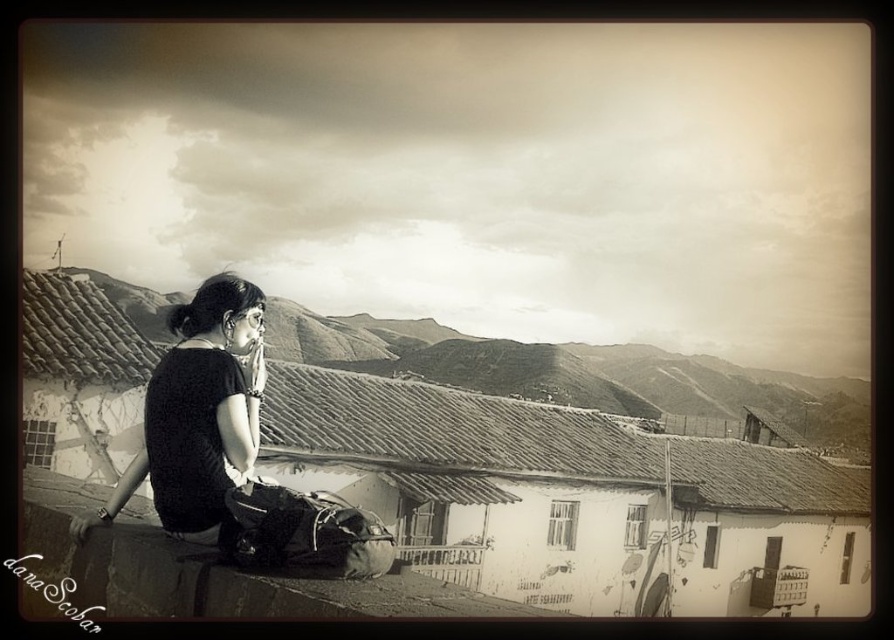
Which of these two, black matte shirt at center or matte black backpack at lower center, stands taller?

With more height is black matte shirt at center.

Is black matte shirt at center below matte black backpack at lower center?

Incorrect, black matte shirt at center is not positioned below matte black backpack at lower center.

Is point (237, 403) farther from viewer compared to point (367, 561)?

Yes, point (237, 403) is behind point (367, 561).

Locate an element on the screen. This screenshot has width=894, height=640. black matte shirt at center is located at coordinates (198, 412).

I want to click on smooth concrete ledge at lower left, so click(x=106, y=548).

At what (x,y) coordinates should I click in order to perform the action: click on smooth concrete ledge at lower left. Please return your answer as a coordinate pair (x, y). The width and height of the screenshot is (894, 640). Looking at the image, I should click on (106, 548).

Find the location of `smooth concrete ledge at lower left`. smooth concrete ledge at lower left is located at coordinates (106, 548).

Which is more to the left, smooth concrete ledge at lower left or matte black backpack at lower center?

smooth concrete ledge at lower left

Does point (89, 561) come closer to viewer compared to point (311, 573)?

That is False.

Locate an element on the screen. smooth concrete ledge at lower left is located at coordinates (106, 548).